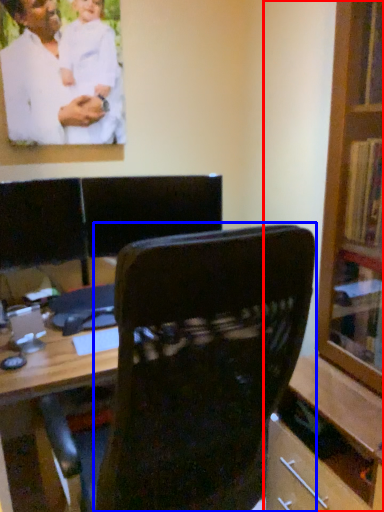
Question: Which object appears closest to the camera in this image, bookcase (highlighted by a red box) or chair (highlighted by a blue box)?

Choices:
 (A) bookcase
 (B) chair

Answer: (B)